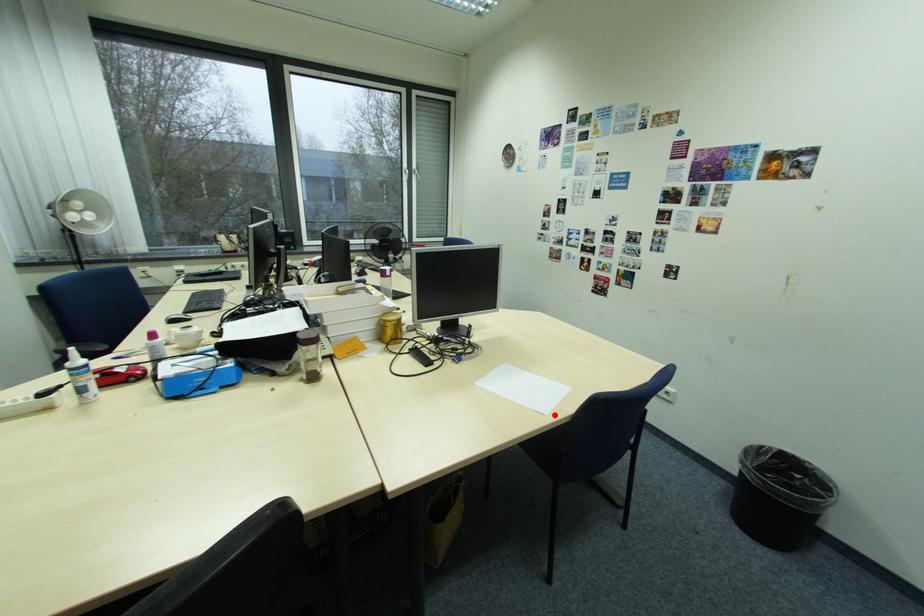
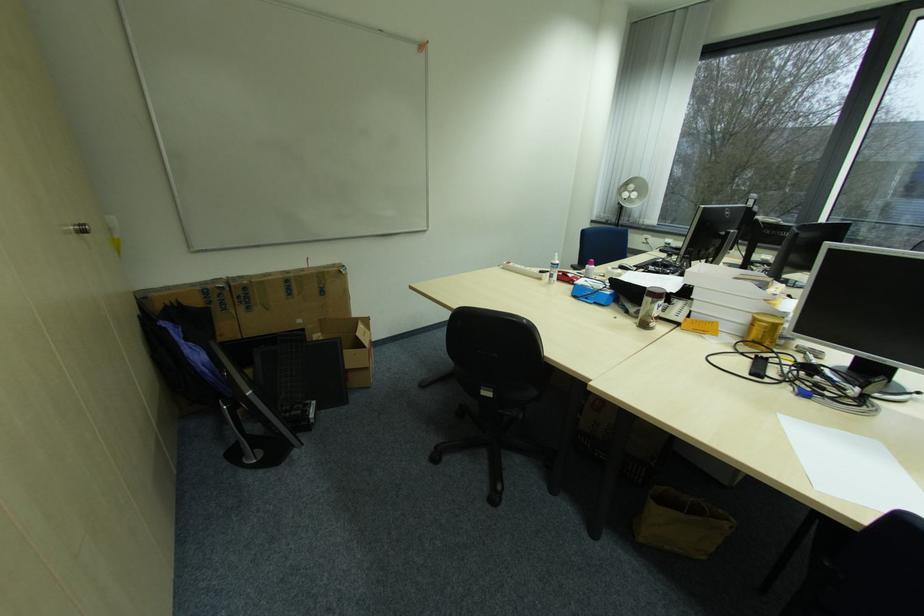
Question: I am providing you with two images of the same scene from different viewpoints. Given a red point in image1, look at the same physical point in image2. Is it:

Choices:
 (A) Closer to the viewpoint
 (B) Farther from the viewpoint

Answer: (B)